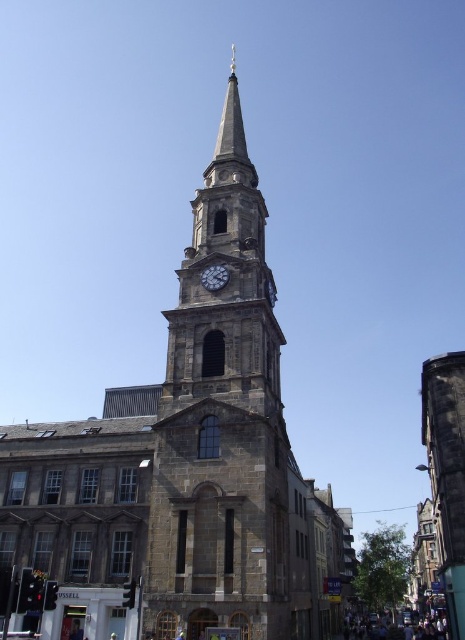
Can you confirm if gray stone church steeple at center is shorter than dark gray stone clock at upper center?

No, gray stone church steeple at center is not shorter than dark gray stone clock at upper center.

Is gray stone church steeple at center positioned before dark gray stone clock at upper center?

That is True.

You are a GUI agent. You are given a task and a screenshot of the screen. Output one action in this format:
    pyautogui.click(x=<x>, y=<y>)
    Task: Click on the gray stone church steeple at center
    This screenshot has height=640, width=465.
    Given the screenshot: What is the action you would take?
    pyautogui.click(x=183, y=467)

Which is in front, point (59, 573) or point (246, 253)?

Point (59, 573) is in front.

Between gray stone church steeple at center and stone clock tower at center, which one appears on the right side from the viewer's perspective?

From the viewer's perspective, gray stone church steeple at center appears more on the right side.

Which is behind, point (310, 572) or point (230, 326)?

Positioned behind is point (310, 572).

Locate an element on the screen. gray stone church steeple at center is located at coordinates (183, 467).

Does stone clock tower at center have a smaller size compared to dark gray stone clock at upper center?

Incorrect, stone clock tower at center is not smaller in size than dark gray stone clock at upper center.

Between stone clock tower at center and dark gray stone clock at upper center, which one appears on the right side from the viewer's perspective?

Positioned to the right is stone clock tower at center.

Which is in front, point (240, 369) or point (227, 280)?

Positioned in front is point (240, 369).

The image size is (465, 640). Identify the location of stone clock tower at center. (225, 289).